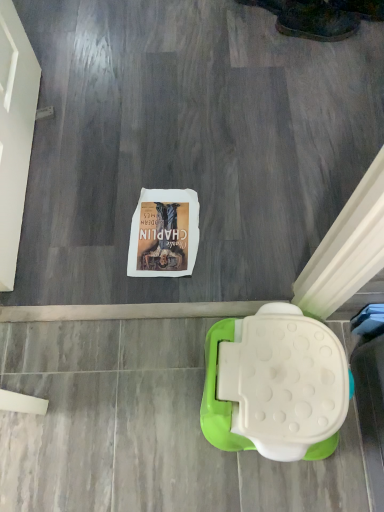
Question: Does leather boot at upper right lie in front of white plastic toilet at lower right?

Choices:
 (A) yes
 (B) no

Answer: (B)

Question: Can you see leather boot at upper right touching white plastic toilet at lower right?

Choices:
 (A) yes
 (B) no

Answer: (B)

Question: From the image's perspective, is leather boot at upper right over white plastic toilet at lower right?

Choices:
 (A) no
 (B) yes

Answer: (B)

Question: Is leather boot at upper right positioned with its back to white plastic toilet at lower right?

Choices:
 (A) yes
 (B) no

Answer: (B)

Question: Considering the relative sizes of leather boot at upper right and white plastic toilet at lower right in the image provided, is leather boot at upper right smaller than white plastic toilet at lower right?

Choices:
 (A) yes
 (B) no

Answer: (A)

Question: Is leather boot at upper right not within white plastic toilet at lower right?

Choices:
 (A) yes
 (B) no

Answer: (A)

Question: Does white plastic toilet at lower right have a greater height compared to leather boot at upper right?

Choices:
 (A) yes
 (B) no

Answer: (A)

Question: From the image's perspective, is white plastic toilet at lower right above leather boot at upper right?

Choices:
 (A) no
 (B) yes

Answer: (A)

Question: Can you confirm if white plastic toilet at lower right is positioned to the left of leather boot at upper right?

Choices:
 (A) yes
 (B) no

Answer: (A)

Question: Can you confirm if white plastic toilet at lower right is smaller than leather boot at upper right?

Choices:
 (A) no
 (B) yes

Answer: (A)

Question: From the image's perspective, is white plastic toilet at lower right below leather boot at upper right?

Choices:
 (A) no
 (B) yes

Answer: (B)

Question: From a real-world perspective, is white plastic toilet at lower right on leather boot at upper right?

Choices:
 (A) no
 (B) yes

Answer: (B)

Question: In terms of width, does white plastic toilet at lower right look wider or thinner when compared to leather boot at upper right?

Choices:
 (A) thin
 (B) wide

Answer: (B)